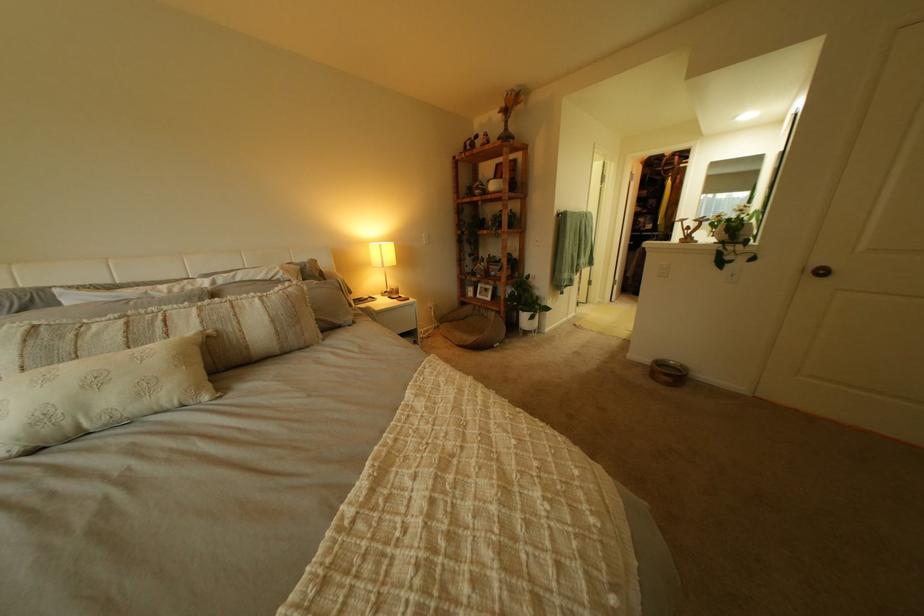
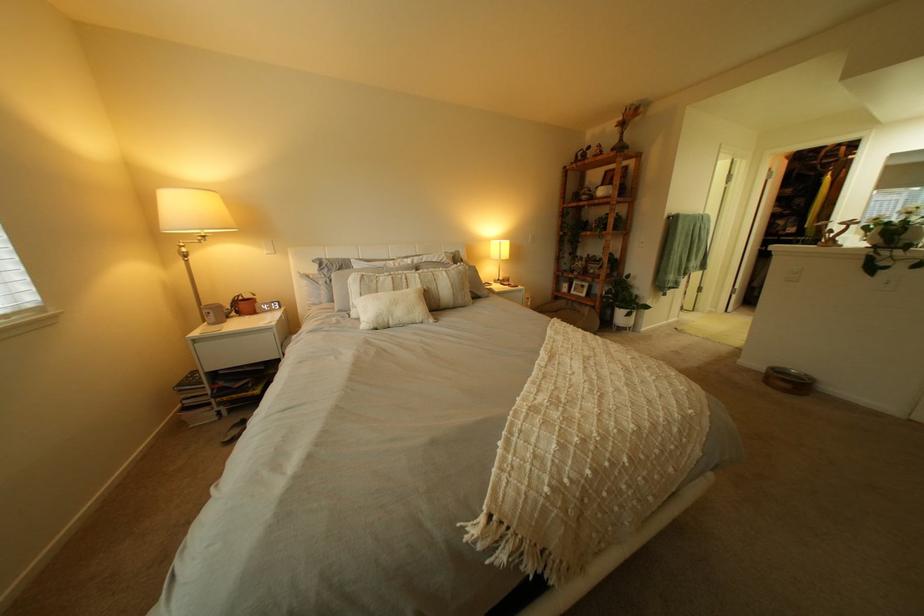
The point at [663,362] is marked in the first image. Where is the corresponding point in the second image?

(779, 369)